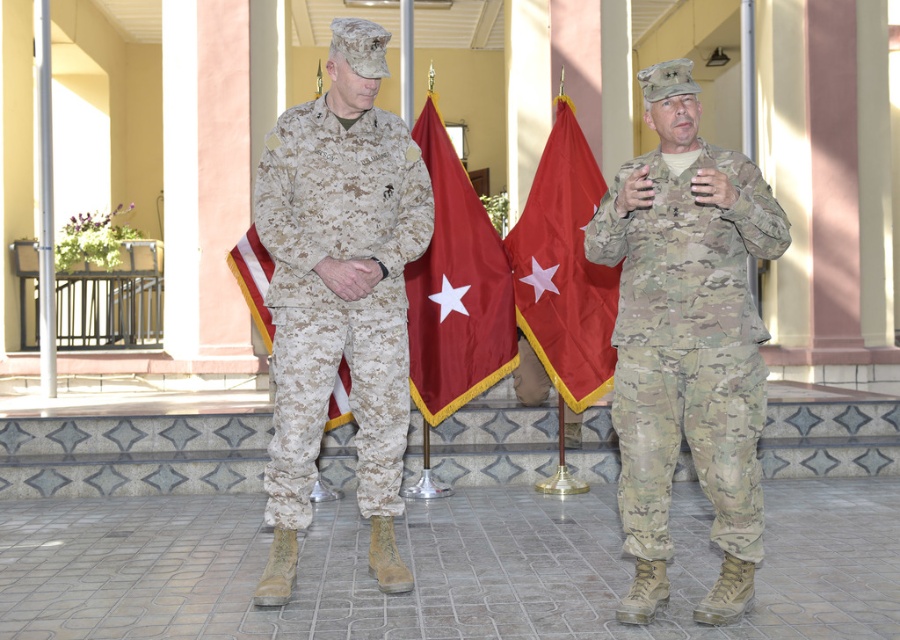
You are a photographer positioned at the front of the scene. You want to capture a photo that includes both the camouflage fabric uniform at center and the maroon fabric flag at center. What is the minimum distance you need to move backward to ensure both subjects are in frame?

The minimum distance you need to move backward is 2.25 meters to ensure both the camouflage fabric uniform at center and the maroon fabric flag at center are in frame.

You are a photographer positioned at the bottom of the steps leading up to the colonnade. You need to take a photo of both the camouflage fabric uniform at right and the camouflage fabric uniform at center. Which uniform should you adjust your camera angle to capture first if you want to follow the natural left to right reading direction?

You should adjust your camera angle to capture the camouflage fabric uniform at center first because it is positioned to the left of the camouflage fabric uniform at right, aligning with the natural left to right reading direction.

You are a photographer at the event and need to capture both flags clearly in a single shot. Given that the maroon fabric flag at center and the camouflage fabric flag at center are both at the center, but one is larger than the other, which flag should you focus on to ensure both are in frame without cropping?

The maroon fabric flag at center is bigger than the camouflage fabric flag at center. To ensure both are in frame without cropping, focus on the larger maroon fabric flag at center, as it occupies more space and the smaller camouflage fabric flag at center will naturally fit within the same shot.